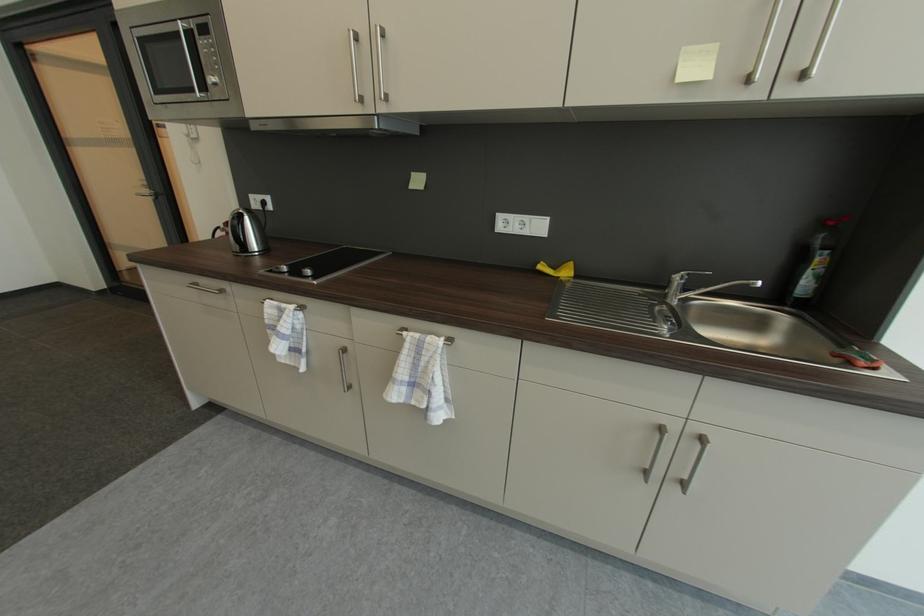
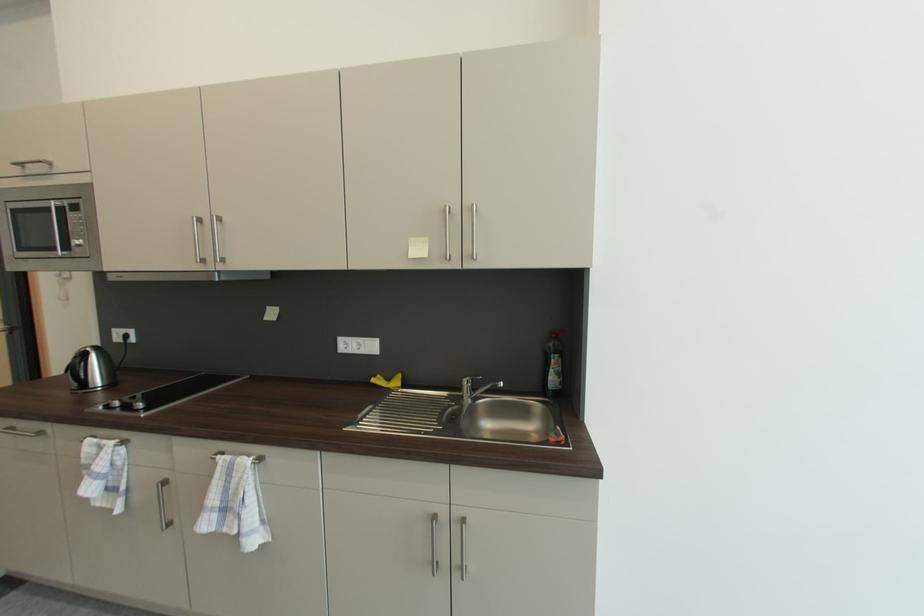
The images are taken continuously from a first-person perspective. In which direction are you moving?

The cameraman walked toward right, backward.